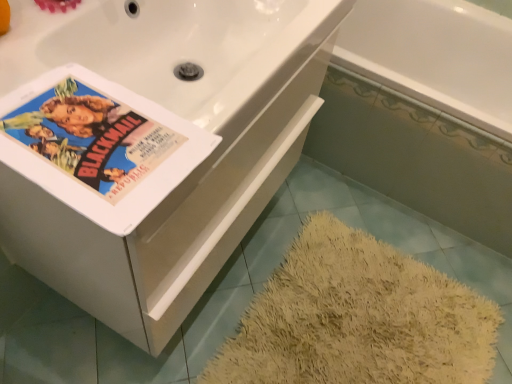
Question: Considering the relative positions of white glossy bathtub at upper right, which is counted as the second bath, starting from the front, and matte paper poster at upper left in the image provided, is white glossy bathtub at upper right, which is counted as the second bath, starting from the front, behind matte paper poster at upper left?

Choices:
 (A) yes
 (B) no

Answer: (A)

Question: Is white glossy bathtub at upper right, which is counted as the second bath, starting from the front, beside matte paper poster at upper left?

Choices:
 (A) no
 (B) yes

Answer: (A)

Question: Is white glossy bathtub at upper right, positioned as the 1th bath in back-to-front order, not inside matte paper poster at upper left?

Choices:
 (A) no
 (B) yes

Answer: (B)

Question: Are white glossy bathtub at upper right, which is counted as the second bath, starting from the front, and matte paper poster at upper left far apart?

Choices:
 (A) yes
 (B) no

Answer: (A)

Question: Considering the relative sizes of white glossy bathtub at upper right, positioned as the 1th bath in back-to-front order, and matte paper poster at upper left in the image provided, is white glossy bathtub at upper right, positioned as the 1th bath in back-to-front order, smaller than matte paper poster at upper left?

Choices:
 (A) yes
 (B) no

Answer: (B)

Question: Considering the positions of point (177, 115) and point (373, 43), is point (177, 115) closer or farther from the camera than point (373, 43)?

Choices:
 (A) closer
 (B) farther

Answer: (A)

Question: Would you say matte paper poster at upper left is inside or outside white glossy bathtub at upper right, positioned as the 1th bath in back-to-front order?

Choices:
 (A) inside
 (B) outside

Answer: (B)

Question: Based on their positions, is matte paper poster at upper left located to the left or right of white glossy bathtub at upper right, which is counted as the second bath, starting from the front?

Choices:
 (A) left
 (B) right

Answer: (A)

Question: Is matte paper poster at upper left bigger or smaller than white glossy bathtub at upper right, positioned as the 1th bath in back-to-front order?

Choices:
 (A) small
 (B) big

Answer: (A)

Question: From a real-world perspective, is white glossy bathtub at upper right, which is counted as the second bath, starting from the front, above or below matte paper poster at upper left?

Choices:
 (A) below
 (B) above

Answer: (A)

Question: Is white glossy bathtub at upper right, which is counted as the second bath, starting from the front, bigger or smaller than matte paper poster at upper left?

Choices:
 (A) big
 (B) small

Answer: (A)

Question: Visually, is white glossy bathtub at upper right, positioned as the 1th bath in back-to-front order, positioned to the left or to the right of matte paper poster at upper left?

Choices:
 (A) right
 (B) left

Answer: (A)

Question: Considering the positions of point (458, 29) and point (26, 91), is point (458, 29) closer or farther from the camera than point (26, 91)?

Choices:
 (A) farther
 (B) closer

Answer: (A)

Question: Relative to matte paper poster at upper left, is white glossy bathtub at lower right, arranged as the second bath when viewed from the back, in front or behind?

Choices:
 (A) front
 (B) behind

Answer: (B)

Question: Considering the relative positions of white glossy bathtub at lower right, arranged as the second bath when viewed from the back, and matte paper poster at upper left in the image provided, is white glossy bathtub at lower right, arranged as the second bath when viewed from the back, to the left or to the right of matte paper poster at upper left?

Choices:
 (A) left
 (B) right

Answer: (B)